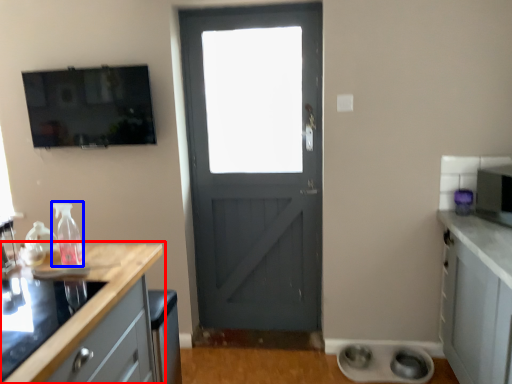
Question: Which point is further to the camera, countertop (highlighted by a red box) or bottle (highlighted by a blue box)?

Choices:
 (A) countertop
 (B) bottle

Answer: (B)